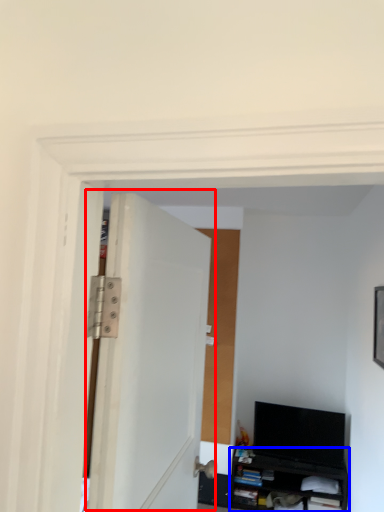
Question: Which point is further to the camera, door (highlighted by a red box) or cabinetry (highlighted by a blue box)?

Choices:
 (A) door
 (B) cabinetry

Answer: (B)